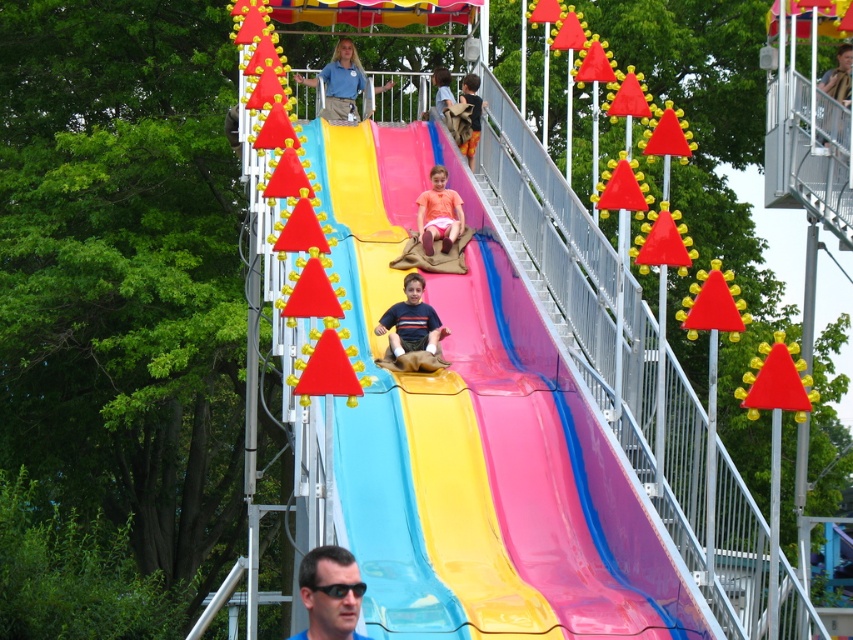
You are standing at the base of the water slide and looking up towards the top. There are two points marked on the slide, point (380, 269) and point (415, 342). Which point is closer to you?

Point (415, 342) is closer to you because it is less further to the camera than point (380, 269).

You are a safety inspector at the fairground and need to ensure that the matte black sunglasses at lower center and the matte blue shirt at upper center are within a 50 meter safety distance. Based on the provided information, are they within the required distance?

The distance between the matte black sunglasses at lower center and the matte blue shirt at upper center is 43.76 meters, which is within the 50 meter safety requirement.

You are a safety inspector standing at the top of the water slide platform. You need to check if the matte black sunglasses at lower center can be seen clearly from your position. The camera you are using is located at your current position. What is the maximum distance the camera can capture clearly? The camera has a maximum clear capture distance of 40 meters.

The matte black sunglasses at lower center and the camera are 39.38 meters apart. Since the camera has a maximum clear capture distance of 40 meters, the sunglasses can be seen clearly.